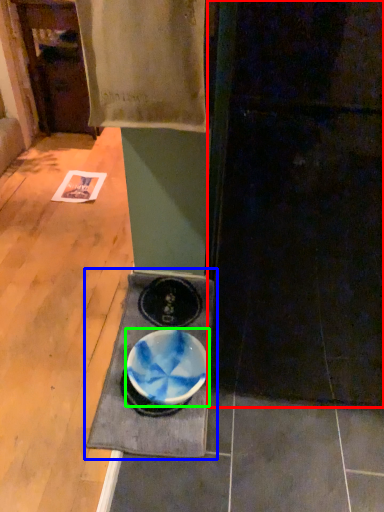
Question: Considering the real-world distances, which object is farthest from door (highlighted by a red box)? table (highlighted by a blue box) or bowl (highlighted by a green box)?

Choices:
 (A) table
 (B) bowl

Answer: (A)